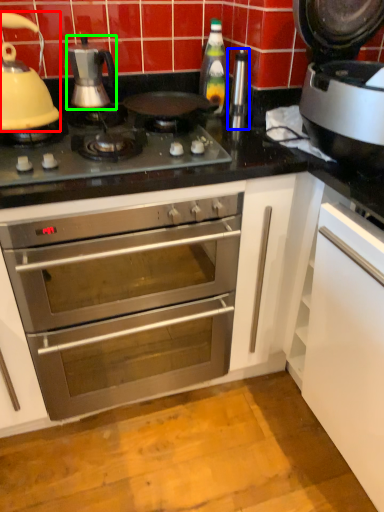
Question: Estimate the real-world distances between objects in this image. Which object is closer to kitchen appliance (highlighted by a red box), appliance (highlighted by a blue box) or kitchen appliance (highlighted by a green box)?

Choices:
 (A) appliance
 (B) kitchen appliance

Answer: (B)